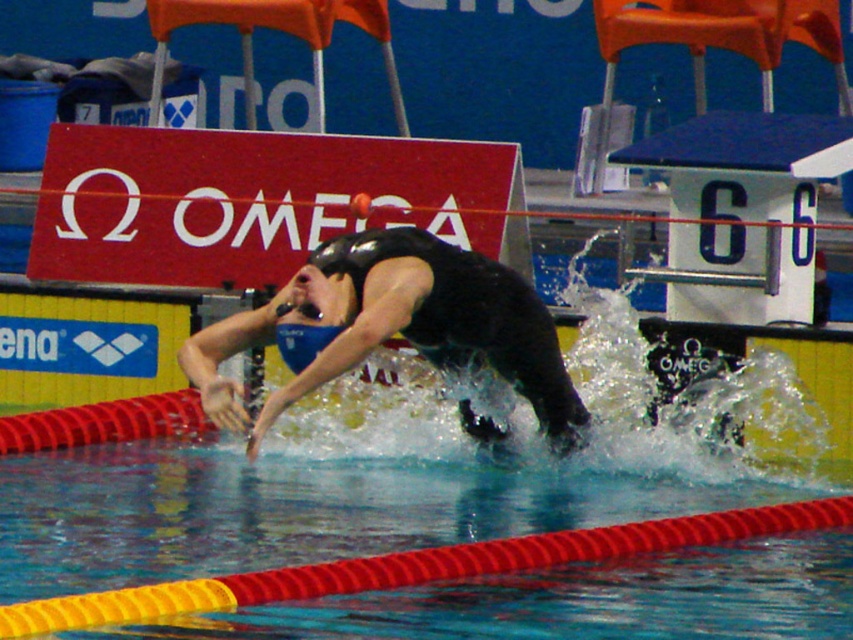
Is smooth rubber pool lane at center thinner than black matte swim cap at center?

In fact, smooth rubber pool lane at center might be wider than black matte swim cap at center.

Between smooth rubber pool lane at center and black matte swim cap at center, which one appears on the left side from the viewer's perspective?

smooth rubber pool lane at center

Where is `smooth rubber pool lane at center`? This screenshot has height=640, width=853. smooth rubber pool lane at center is located at coordinates (314, 508).

This screenshot has width=853, height=640. I want to click on smooth rubber pool lane at center, so click(314, 508).